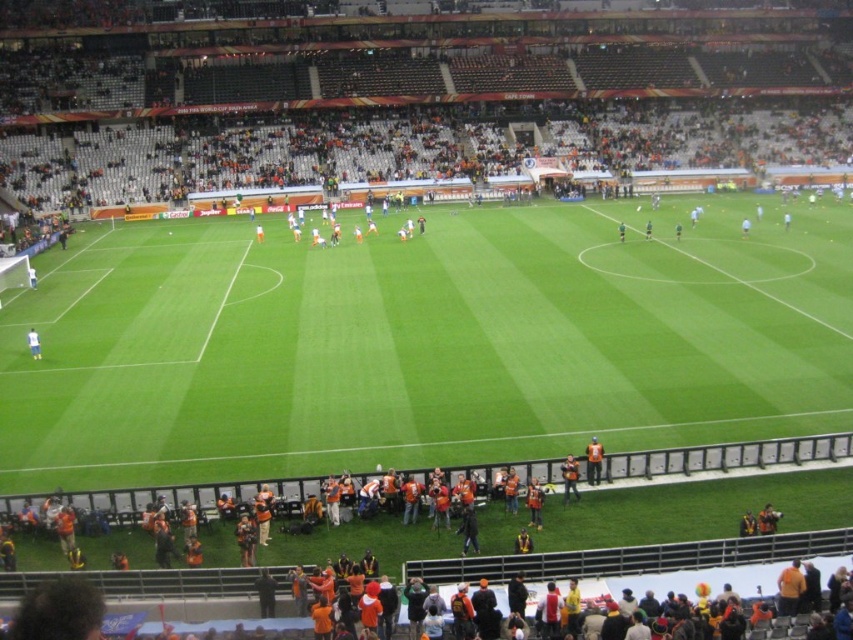
You are a photographer positioned at the edge of the soccer field. You need to take a photo that includes both the orange fabric jacket at lower center and the white matte shirt at lower left. Which of these two items should you adjust your camera angle to focus on first to ensure both are in frame?

The orange fabric jacket at lower center is taller than the white matte shirt at lower left, so you should focus on the orange fabric jacket at lower center first to ensure both are in frame.

You are a photographer standing at the edge of the soccer field. You want to take a photo that includes both the green grass football field at center and the orange fabric jacket at lower center. Which object will appear larger in the photo?

The green grass football field at center will appear larger in the photo because it has a greater height compared to the orange fabric jacket at lower center.

You are a photographer standing at the edge of the green grass football field at center and want to take a picture of the orange fabric jacket at lower center. Considering the size difference between the two, which object will appear larger in your photo?

The green grass football field at center will appear larger in the photo because it is bigger than the orange fabric jacket at lower center.